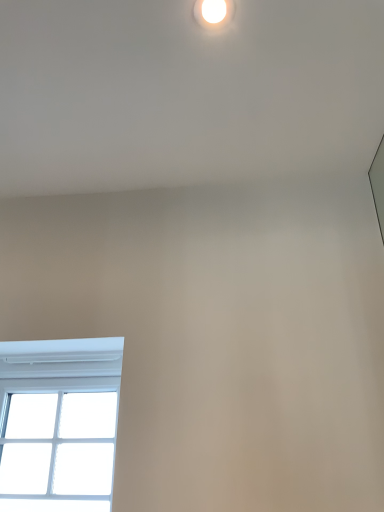
Question: Would you say white glossy droplight at upper center is inside or outside white plastic window at lower left?

Choices:
 (A) outside
 (B) inside

Answer: (A)

Question: Is white glossy droplight at upper center wider or thinner than white plastic window at lower left?

Choices:
 (A) thin
 (B) wide

Answer: (A)

Question: Is white glossy droplight at upper center bigger or smaller than white plastic window at lower left?

Choices:
 (A) big
 (B) small

Answer: (B)

Question: Is white plastic window at lower left bigger or smaller than white glossy droplight at upper center?

Choices:
 (A) small
 (B) big

Answer: (B)

Question: In the image, is white plastic window at lower left on the left side or the right side of white glossy droplight at upper center?

Choices:
 (A) right
 (B) left

Answer: (B)

Question: Is white plastic window at lower left taller or shorter than white glossy droplight at upper center?

Choices:
 (A) tall
 (B) short

Answer: (A)

Question: Is white plastic window at lower left wider or thinner than white glossy droplight at upper center?

Choices:
 (A) wide
 (B) thin

Answer: (A)